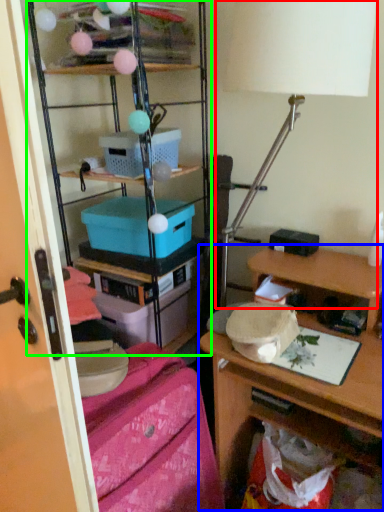
Question: Estimate the real-world distances between objects in this image. Which object is closer to table lamp (highlighted by a red box), desk (highlighted by a blue box) or shelf (highlighted by a green box)?

Choices:
 (A) desk
 (B) shelf

Answer: (A)